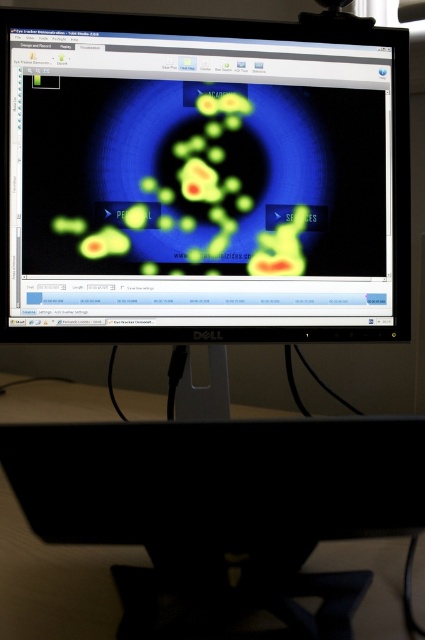
You are sitting at a desk and want to adjust your posture to look at both the matte plastic monitor at center and the wooden table at bottom comfortably. Which object should you look at first to avoid straining your neck?

You should look at the matte plastic monitor at center first because it is closer to the viewer than the wooden table at bottom, so adjusting your posture to focus on the closer object first will reduce neck strain.

You are setting up a workstation and need to place both the matte plastic monitor at center and the wooden table at bottom. Given their sizes, which object should you place first to ensure proper positioning?

The matte plastic monitor at center is bigger than the wooden table at bottom, so you should place the matte plastic monitor at center first to ensure proper positioning.

In the scene shown: You are standing in front of a desk with a Dell monitor. You need to place a small sticker exactly at the center of the matte plastic monitor at center. According to the coordinates provided, where should you place the sticker on the monitor?

The sticker should be placed at the coordinates point (203,179) on the matte plastic monitor at center as that is its 2D location.